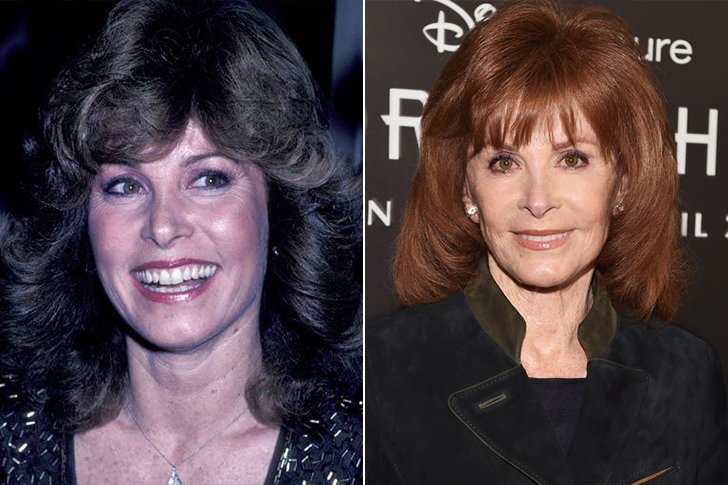
This screenshot has width=728, height=485. Identify the location of veneers. (539, 237).